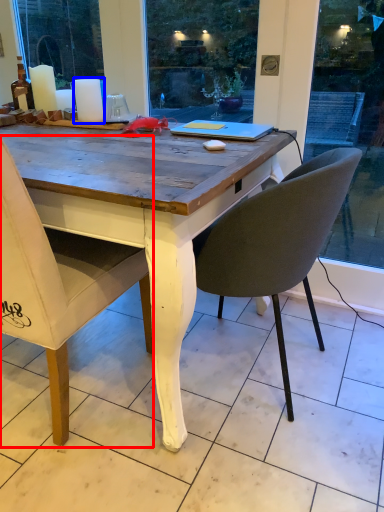
Question: Which point is closer to the camera, chair (highlighted by a red box) or candle (highlighted by a blue box)?

Choices:
 (A) chair
 (B) candle

Answer: (A)